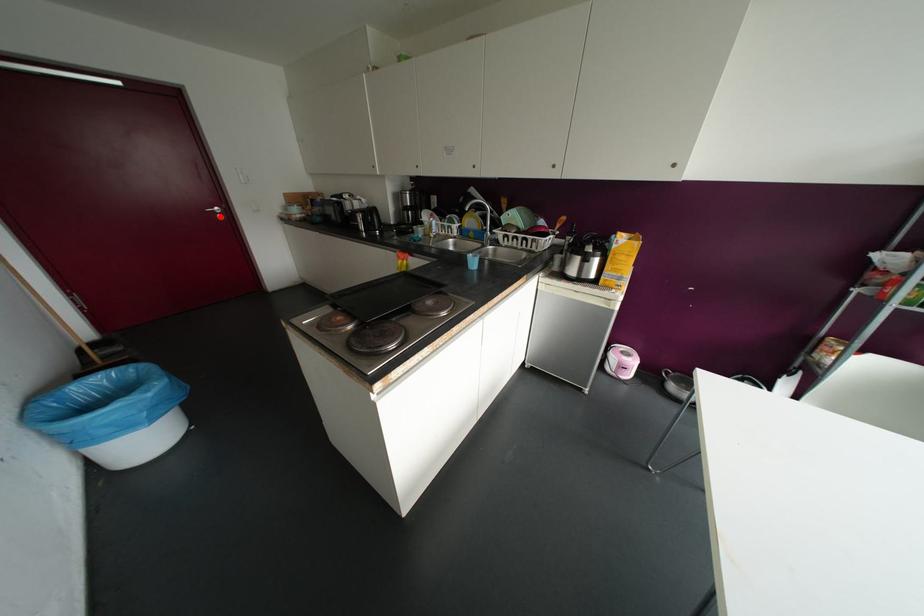
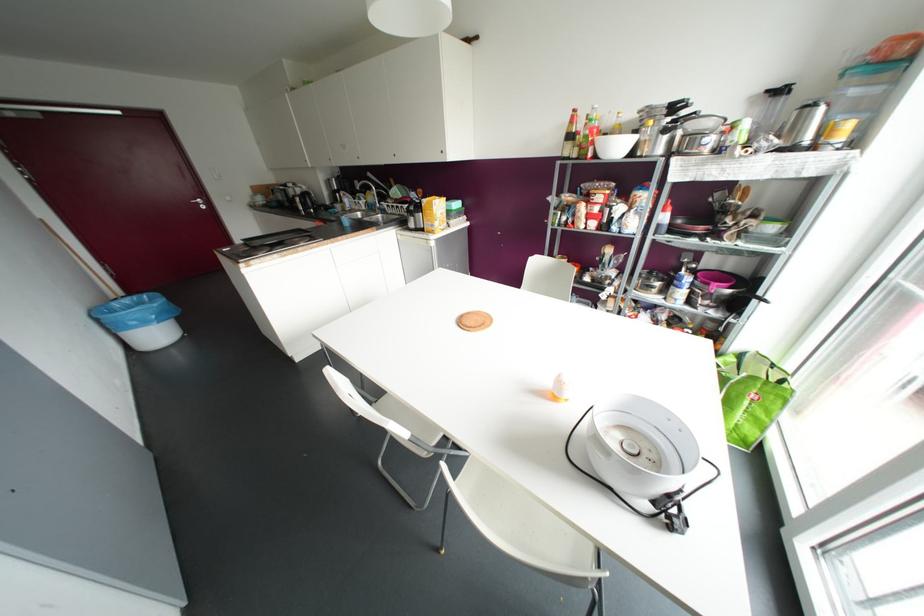
Find the pixel in the second image that matches the highlighted location in the first image.

(202, 207)